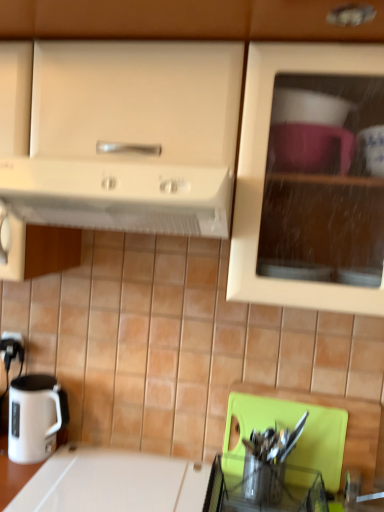
Question: From a real-world perspective, is white glossy electric kettle at lower left positioned above or below white plastic electric outlet at lower left?

Choices:
 (A) above
 (B) below

Answer: (B)

Question: Which is correct: white glossy electric kettle at lower left is inside white plastic electric outlet at lower left, or outside of it?

Choices:
 (A) outside
 (B) inside

Answer: (A)

Question: Which object is the closest to the matte white cabinet at upper center?

Choices:
 (A) white glossy electric kettle at lower left
 (B) white matte range hood at upper center
 (C) white glossy countertop at lower left
 (D) white plastic electric outlet at lower left

Answer: (B)

Question: Which of these objects is positioned farthest from the white plastic electric outlet at lower left?

Choices:
 (A) white matte range hood at upper center
 (B) matte white cabinet at upper center
 (C) white glossy electric kettle at lower left
 (D) white glossy countertop at lower left

Answer: (B)